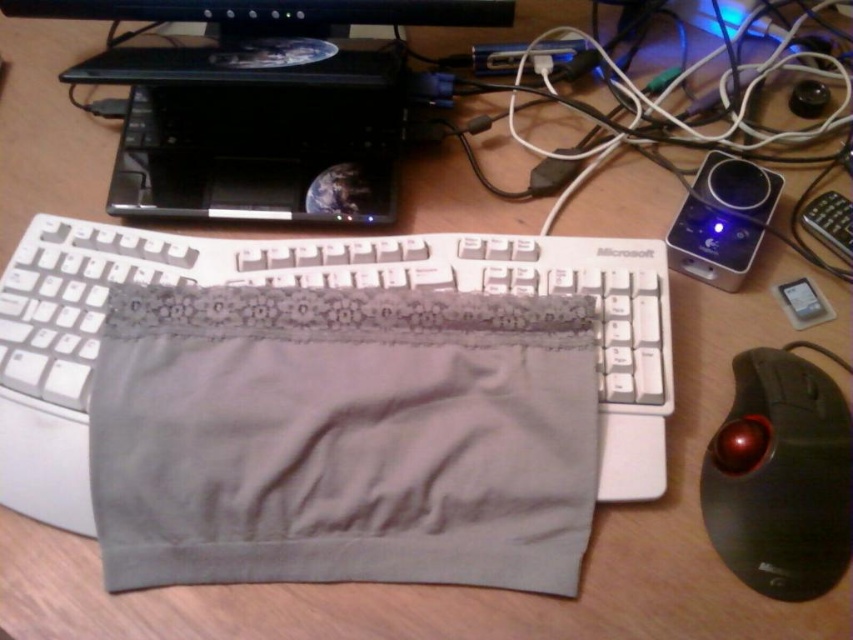
Question: Is satin black laptop at upper center to the right of black plastic monitor at upper center from the viewer's perspective?

Choices:
 (A) yes
 (B) no

Answer: (B)

Question: Is gray fabric pocket at center wider than satin black laptop at upper center?

Choices:
 (A) yes
 (B) no

Answer: (A)

Question: Which of the following is the closest to the observer?

Choices:
 (A) black plastic monitor at upper center
 (B) gray fabric pocket at center
 (C) black rubberized trackball at lower right

Answer: (C)

Question: Which point is farther to the camera?

Choices:
 (A) black rubberized trackball at lower right
 (B) gray fabric pocket at center

Answer: (B)

Question: From the image, what is the correct spatial relationship of gray fabric pocket at center in relation to black rubberized trackball at lower right?

Choices:
 (A) right
 (B) left

Answer: (B)

Question: Which of the following is the closest to the observer?

Choices:
 (A) (323, 22)
 (B) (144, 77)
 (C) (740, 484)
 (D) (569, 445)

Answer: (C)